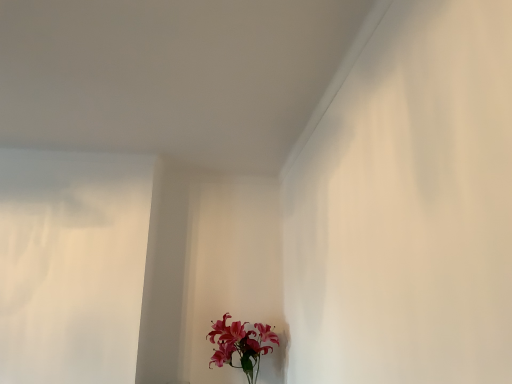
Question: Should I look upward or downward to see pink silk flowers at lower center?

Choices:
 (A) down
 (B) up

Answer: (A)